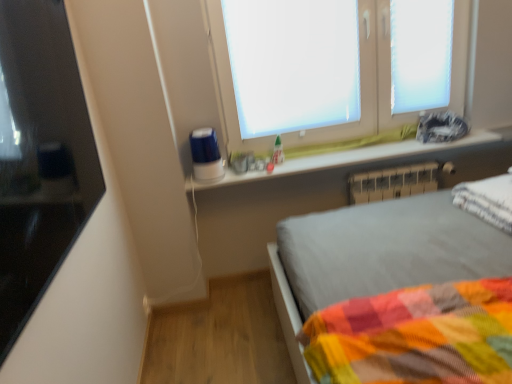
Find the location of a particular element. free space above white glossy window sill at upper center (from a real-world perspective) is located at coordinates (345, 153).